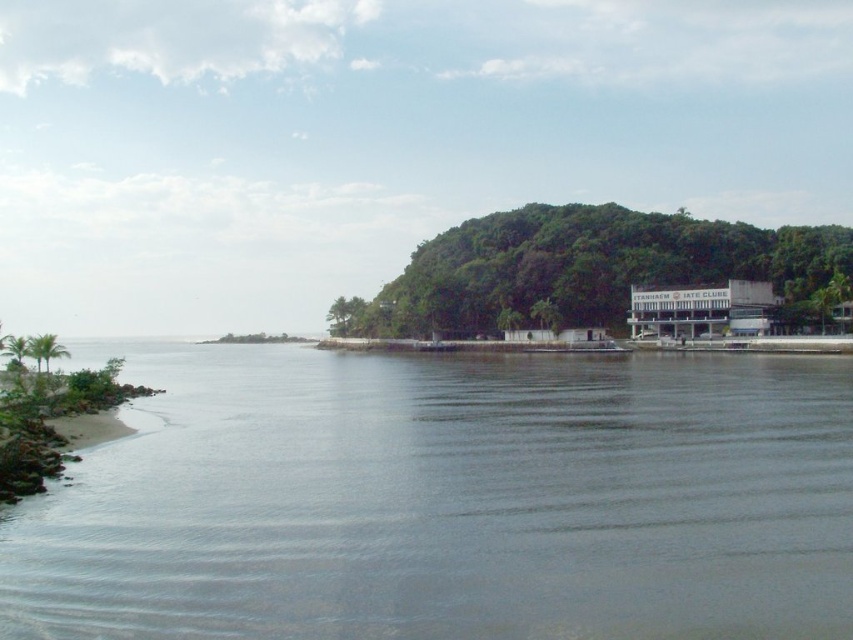
You are a bird flying over the coastal scene. You want to land on the tallest tree. Which tree should you choose between the green leafy trees at center and the green leafy tree at center?

The green leafy trees at center is taller than the green leafy tree at center, so you should choose the green leafy trees at center to land on.

You are standing on the beach and see the green leafy trees at center and the green leafy tree at center in the distance. Which one is closer to you?

The green leafy trees at center is closer to you because it is in front of the green leafy tree at center.

Consider the image. You are standing on the sandy beach on the left side of the image. You see a point marked at coordinates [45,349]. Which object is this point located on?

The point is located on the green leafy palm tree at lower left.